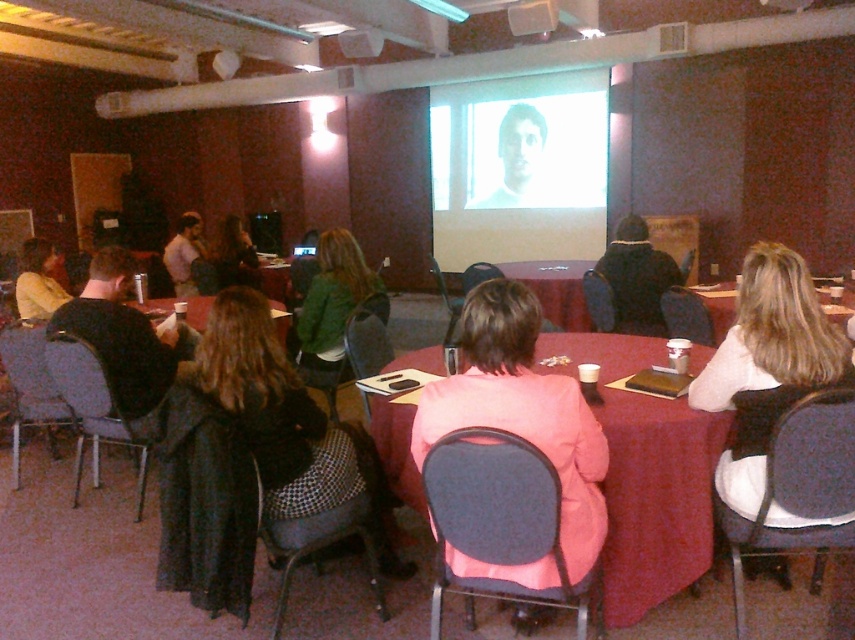
Question: Is maroon fabric table at center thinner than smooth black table at center?

Choices:
 (A) no
 (B) yes

Answer: (B)

Question: Which is farther from the green fabric jacket at center?

Choices:
 (A) white glossy projection screen at upper center
 (B) matte yellow jacket at left
 (C) blonde hair at center
 (D) black fuzzy coat at center

Answer: (A)

Question: Which object is closer to the camera taking this photo?

Choices:
 (A) white glossy projection screen at upper center
 (B) matte yellow jacket at left
 (C) smooth wooden table at center

Answer: (C)

Question: Can you confirm if maroon fabric table at center is positioned to the right of white glossy projection screen at upper center?

Choices:
 (A) no
 (B) yes

Answer: (A)

Question: In this image, where is white glossy projection screen at upper center located relative to smooth black table at center?

Choices:
 (A) below
 (B) above

Answer: (B)

Question: Considering the real-world distances, which object is closest to the dark brown hair at center?

Choices:
 (A) green fabric jacket at center
 (B) matte yellow jacket at left
 (C) smooth black table at center

Answer: (C)